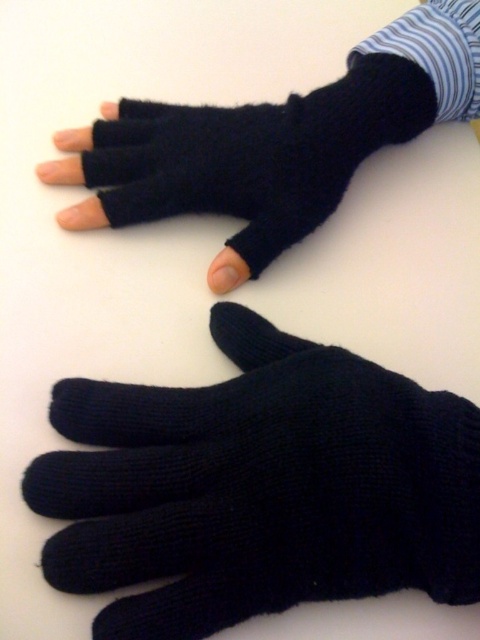
Question: Among these objects, which one is nearest to the camera?

Choices:
 (A) black knitted glove at center
 (B) black knitted fingerless glove at upper center

Answer: (A)

Question: Does black knitted glove at center appear under black knitted fingerless glove at upper center?

Choices:
 (A) no
 (B) yes

Answer: (B)

Question: Which point is closer to the camera taking this photo?

Choices:
 (A) (320, 205)
 (B) (254, 589)

Answer: (B)

Question: Where is black knitted glove at center located in relation to black knitted fingerless glove at upper center in the image?

Choices:
 (A) below
 (B) above

Answer: (A)

Question: Among these objects, which one is nearest to the camera?

Choices:
 (A) black knitted glove at center
 (B) black knitted fingerless glove at upper center

Answer: (A)

Question: Is black knitted glove at center above black knitted fingerless glove at upper center?

Choices:
 (A) yes
 (B) no

Answer: (B)